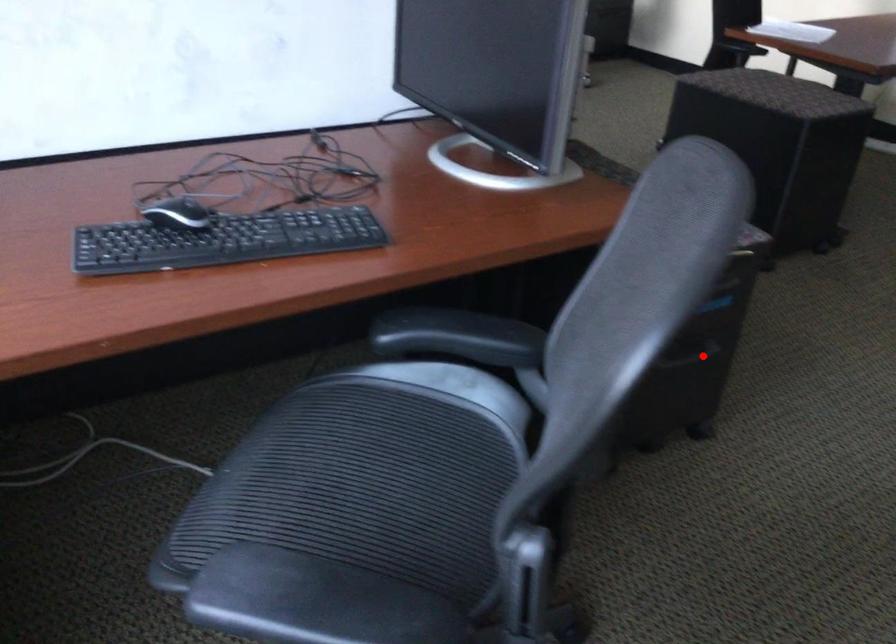
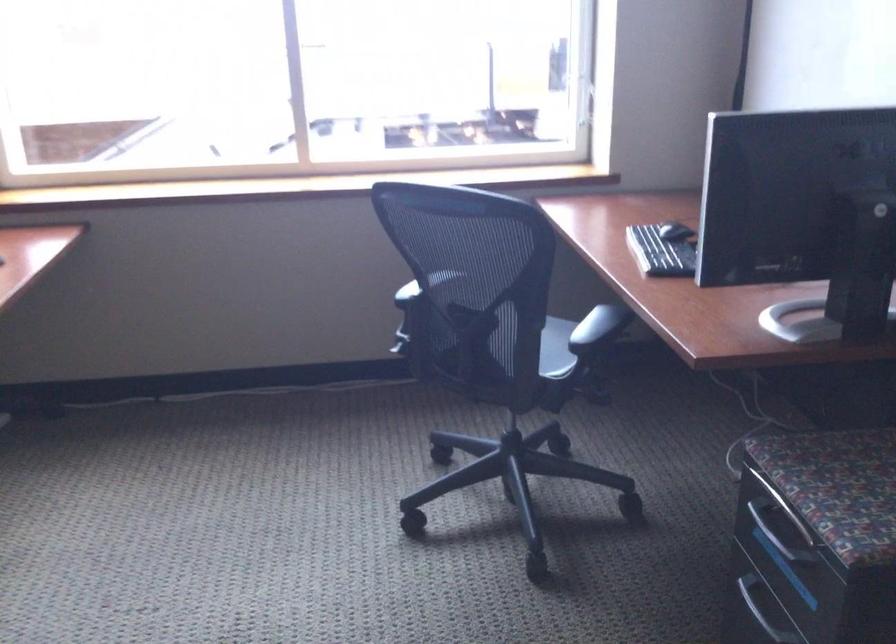
Find the pixel in the second image that matches the highlighted location in the first image.

(755, 614)